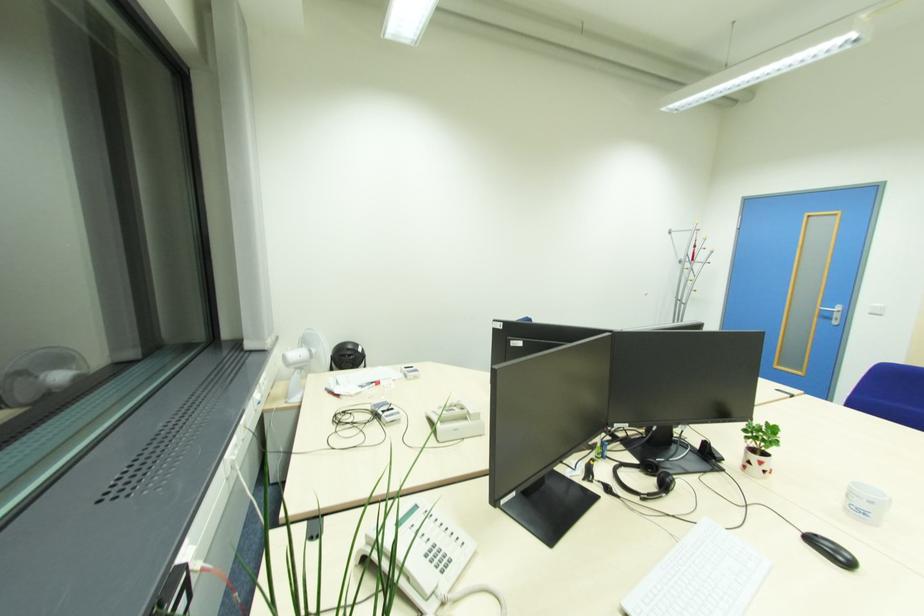
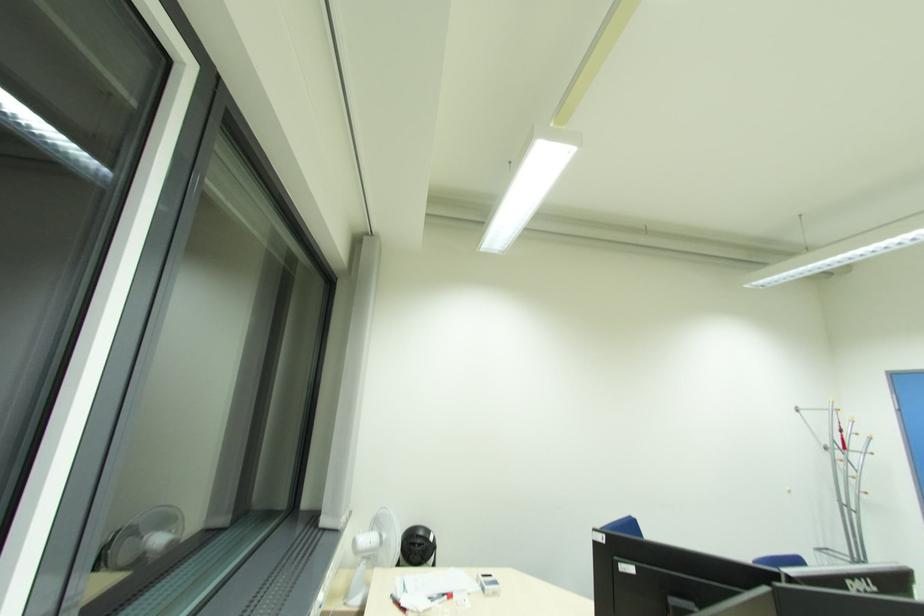
What movement of the cameraman would produce the second image?

The cameraman moved toward left, backward.